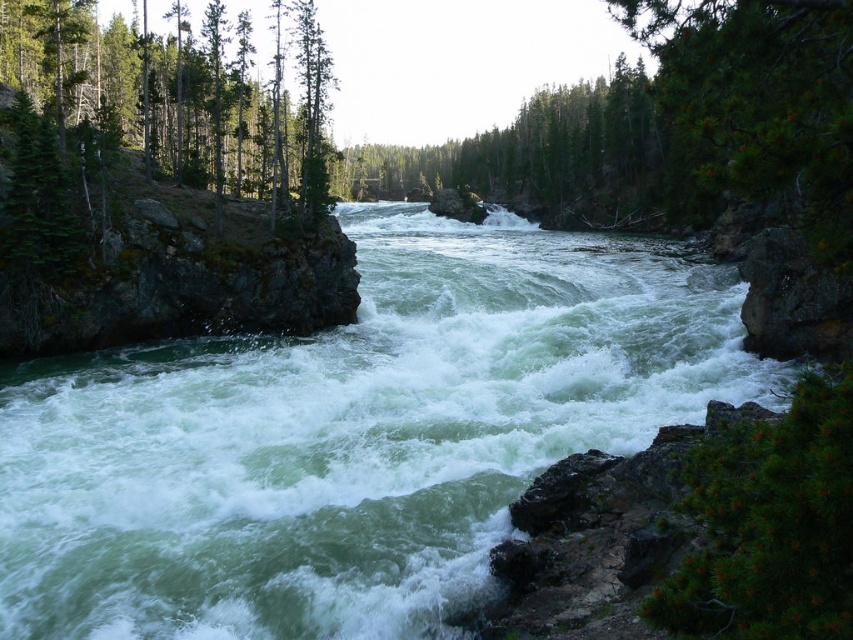
You are a hiker who wants to cross the river using the path between the green smooth water at center and the green matte tree at left. Which direction should you go to avoid the rapids?

The green smooth water at center is positioned on the right side of green matte tree at left, so to avoid the rapids, you should head towards the left side of the green matte tree at left where the water might be calmer.

You are a kayaker planning to navigate the river shown in the image. You see the green smooth water at center and the green matte tree at left. How far apart are these two landmarks?

The green smooth water at center is 32.17 meters from the green matte tree at left.

You are a kayaker planning to navigate the river shown. You see the green smooth water at center and the green matte tree at left. Which one is wider from your perspective?

The green matte tree at left is wider than the green smooth water at center.